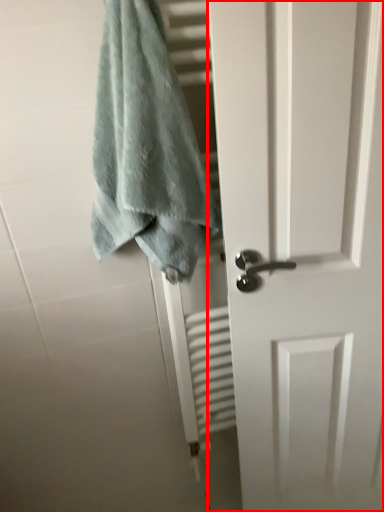
Question: In this image, where is door (annotated by the red box) located relative to towel?

Choices:
 (A) left
 (B) right

Answer: (B)